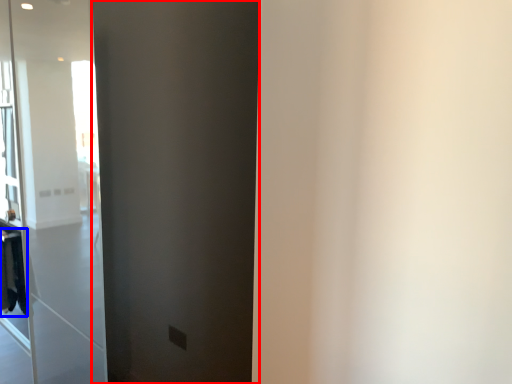
Question: Among these objects, which one is nearest to the camera, barn door (highlighted by a red box) or laundry (highlighted by a blue box)?

Choices:
 (A) barn door
 (B) laundry

Answer: (A)